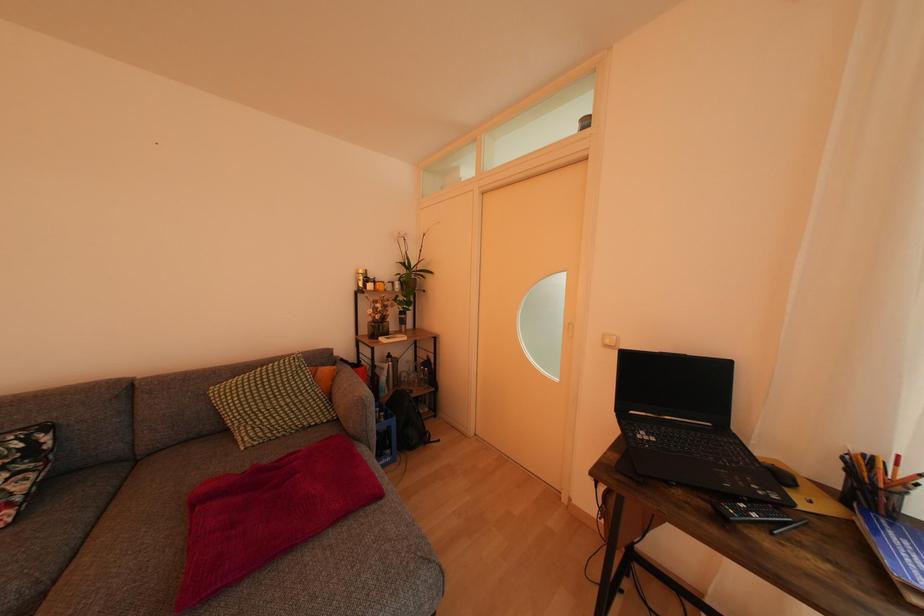
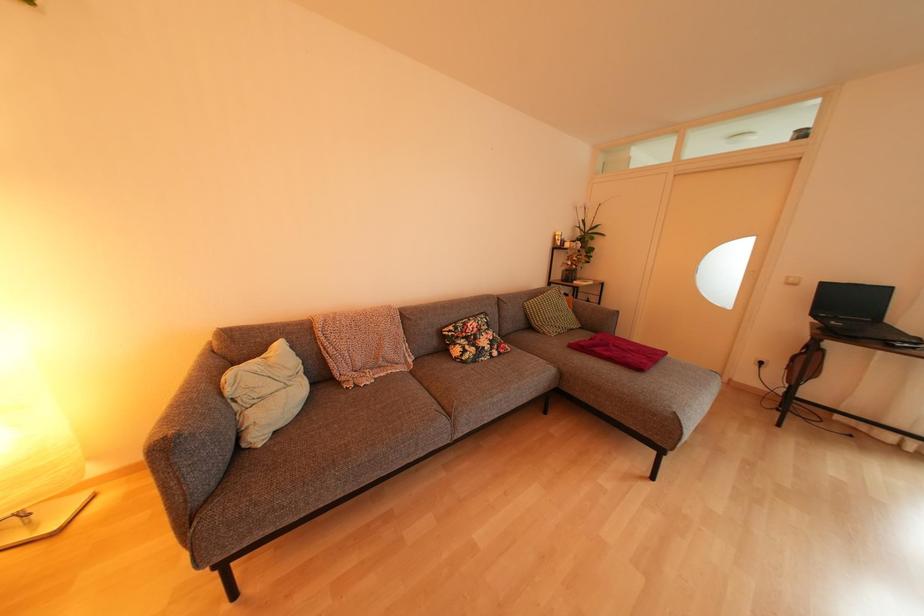
What movement of the cameraman would produce the second image?

The movement direction of the cameraman is left, backward.